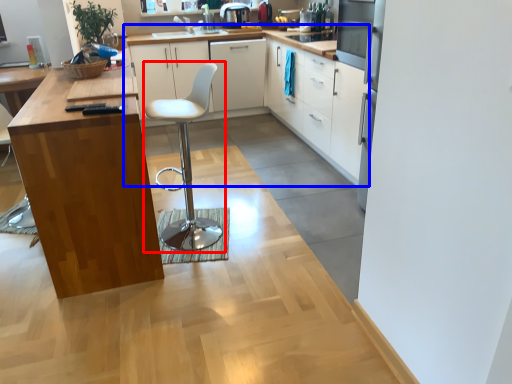
Question: Which object appears farthest to the camera in this image, swivel chair (highlighted by a red box) or cabinetry (highlighted by a blue box)?

Choices:
 (A) swivel chair
 (B) cabinetry

Answer: (B)